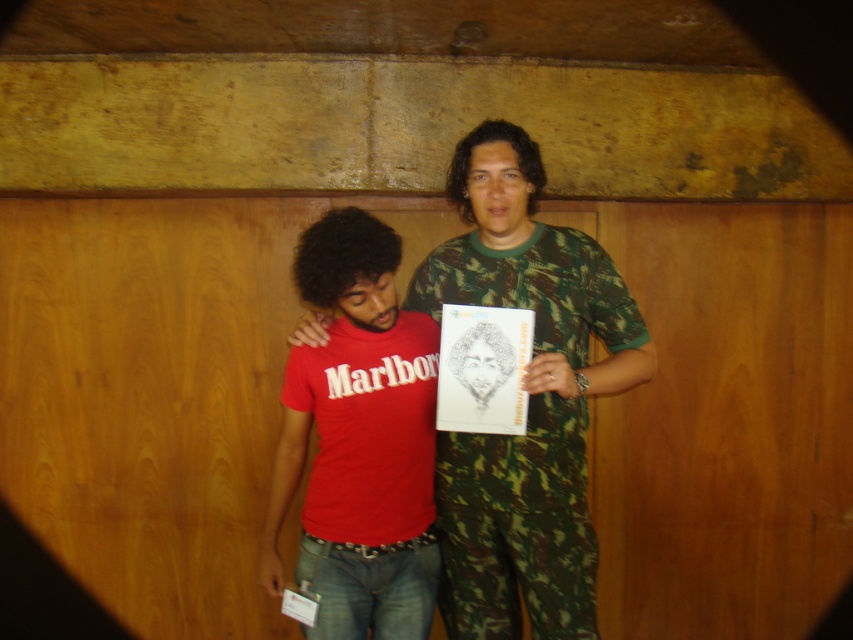
Question: Is red matte shirt at center to the right of matte black sketchbook at center from the viewer's perspective?

Choices:
 (A) no
 (B) yes

Answer: (A)

Question: Which point appears closest to the camera in this image?

Choices:
 (A) (436, 493)
 (B) (328, 269)

Answer: (B)

Question: Which object is the farthest from the camouflage fabric at center?

Choices:
 (A) matte black sketchbook at center
 (B) red matte shirt at center

Answer: (A)

Question: Is red matte shirt at center positioned behind matte black sketchbook at center?

Choices:
 (A) no
 (B) yes

Answer: (A)

Question: Where is camouflage fabric at center located in relation to red matte shirt at center in the image?

Choices:
 (A) below
 (B) above

Answer: (B)

Question: Based on their relative distances, which object is farther from the camouflage fabric at center?

Choices:
 (A) red matte shirt at center
 (B) matte black sketchbook at center

Answer: (B)